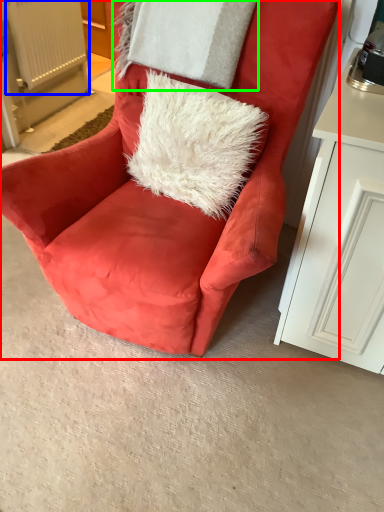
Question: Considering the real-world distances, which object is farthest from chair (highlighted by a red box)? radiator (highlighted by a blue box) or pillow (highlighted by a green box)?

Choices:
 (A) radiator
 (B) pillow

Answer: (A)